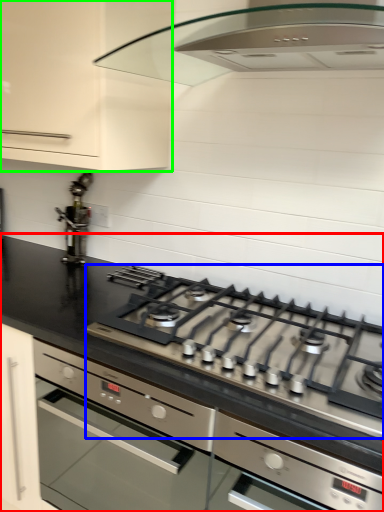
Question: Which is nearer to the countertop (highlighted by a red box)? gas stove (highlighted by a blue box) or cabinetry (highlighted by a green box).

Choices:
 (A) gas stove
 (B) cabinetry

Answer: (A)